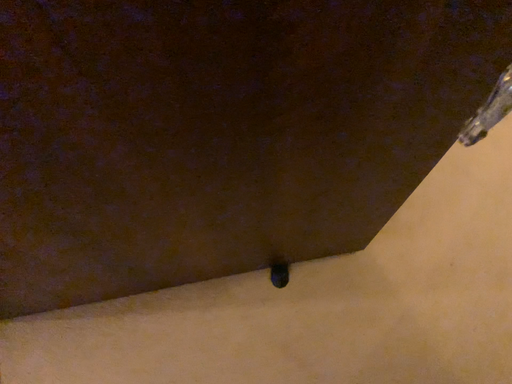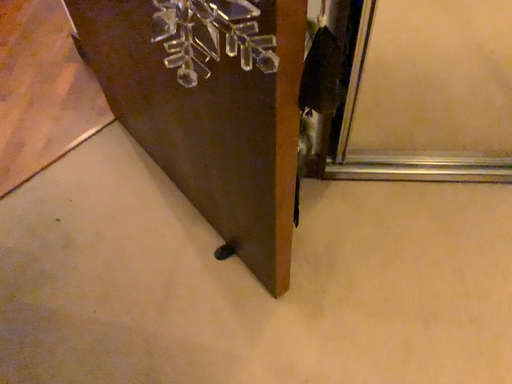
Question: How did the camera likely rotate when shooting the video?

Choices:
 (A) rotated downward
 (B) rotated upward

Answer: (B)